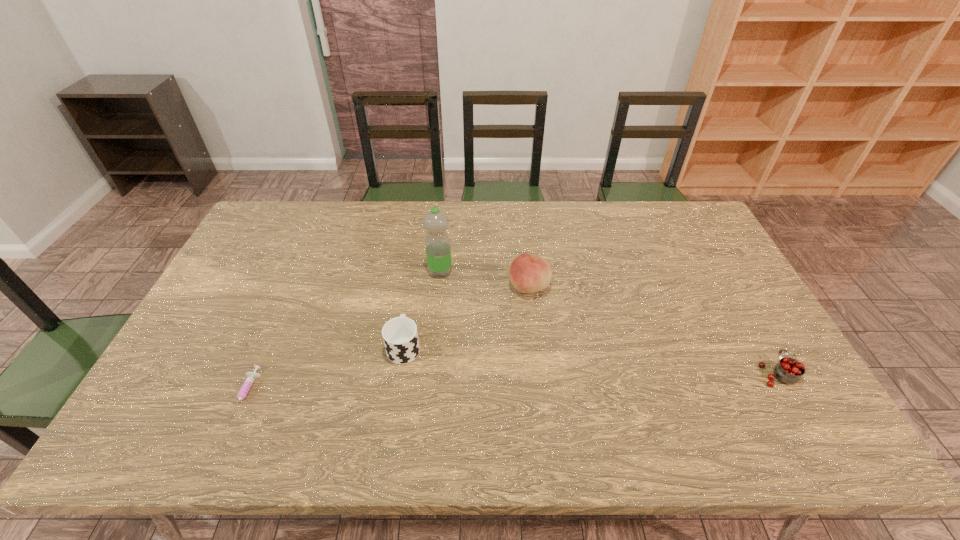
What are the coordinates of `free space located 0.110m on the side of the cup with the handle` in the screenshot? It's located at (411, 300).

This screenshot has height=540, width=960. I want to click on vacant space located 0.370m on the side of the cup with the handle, so click(420, 244).

At what (x,y) coordinates should I click in order to perform the action: click on vacant point located 0.100m on the handle side of the rightmost object. Please return your answer as a coordinate pair (x, y). Looking at the image, I should click on (752, 329).

Identify the location of vacant space located on the handle side of the rightmost object. (726, 284).

Find the location of a particular element. The width and height of the screenshot is (960, 540). vacant area situated on the handle side of the rightmost object is located at coordinates (722, 277).

Identify the location of blank space located on the left of the syringe. (166, 394).

At what (x,y) coordinates should I click in order to perform the action: click on object that is at the near edge. Please return your answer as a coordinate pair (x, y). The width and height of the screenshot is (960, 540). Looking at the image, I should click on coord(251,376).

The width and height of the screenshot is (960, 540). Identify the location of object that is at the right edge. (789, 370).

In the image, there is a desktop. Identify the location of vacant space at the far edge. The height and width of the screenshot is (540, 960). (597, 232).

At what (x,y) coordinates should I click in order to perform the action: click on vacant space at the near edge of the desktop. Please return your answer as a coordinate pair (x, y). This screenshot has height=540, width=960. Looking at the image, I should click on (673, 427).